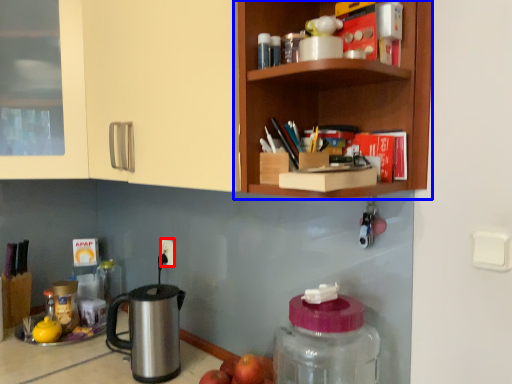
Question: Among these objects, which one is farthest to the camera, electric outlet (highlighted by a red box) or shelf (highlighted by a blue box)?

Choices:
 (A) electric outlet
 (B) shelf

Answer: (A)